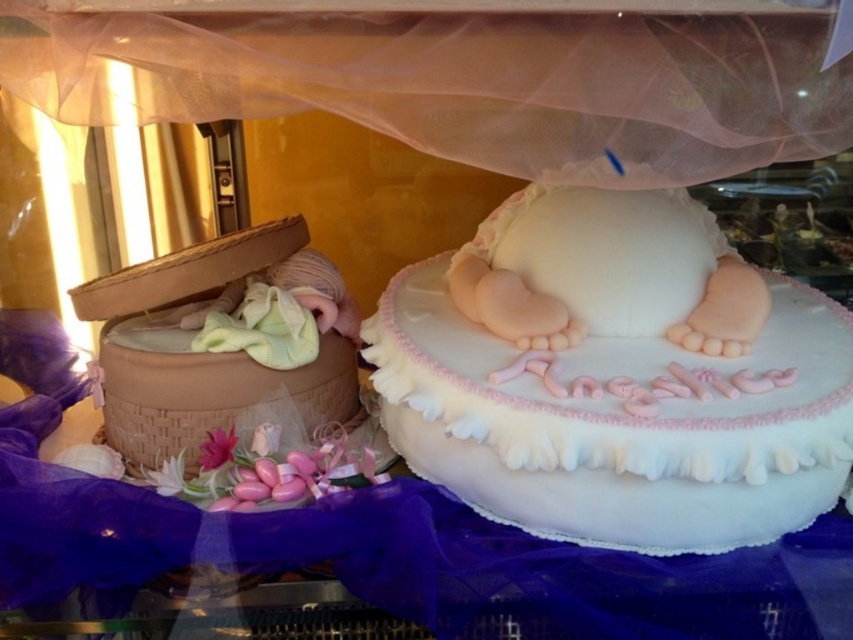
Does braided wicker basket at left have a smaller size compared to pink matte flower at lower left?

No, braided wicker basket at left is not smaller than pink matte flower at lower left.

Who is higher up, braided wicker basket at left or pink matte flower at lower left?

Positioned higher is braided wicker basket at left.

Which is in front, point (138, 276) or point (212, 460)?

Point (212, 460)

The height and width of the screenshot is (640, 853). I want to click on braided wicker basket at left, so click(206, 353).

Describe the element at coordinates (614, 378) in the screenshot. I see `white fondant cake at center` at that location.

Does white fondant cake at center have a larger size compared to pink matte flower at lower left?

Correct, white fondant cake at center is larger in size than pink matte flower at lower left.

What do you see at coordinates (614, 378) in the screenshot?
I see `white fondant cake at center` at bounding box center [614, 378].

This screenshot has width=853, height=640. In order to click on white fondant cake at center in this screenshot , I will do `click(614, 378)`.

Locate an element on the screen. This screenshot has width=853, height=640. white fondant cake at center is located at coordinates (614, 378).

Is white fondant cake at center further to camera compared to braided wicker basket at left?

That is False.

This screenshot has height=640, width=853. I want to click on white fondant cake at center, so click(x=614, y=378).